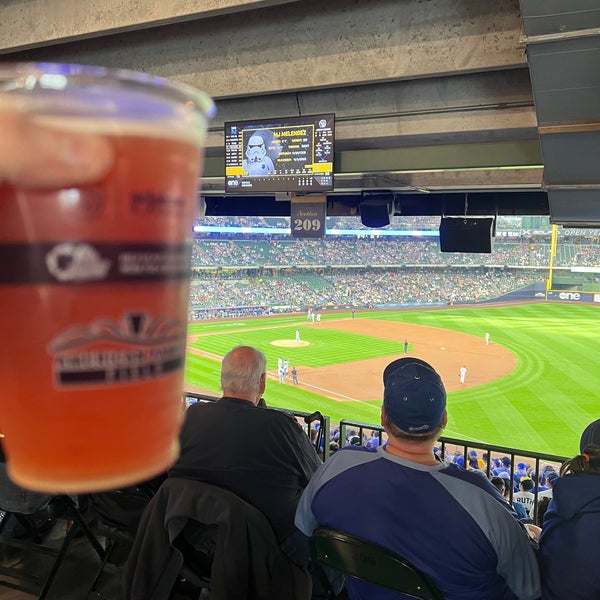
Find the location of a particular element. disposable plastic cup is located at coordinates (153, 110).